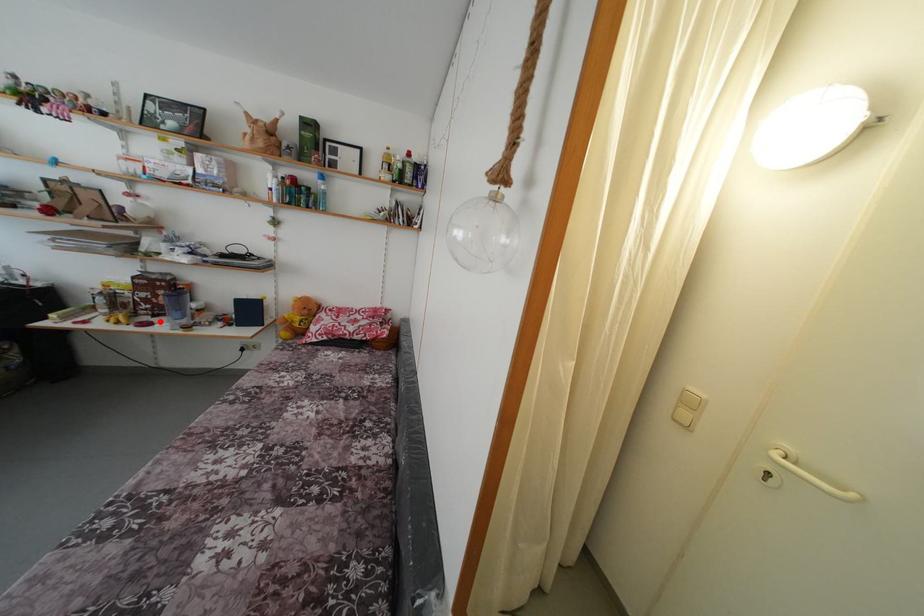
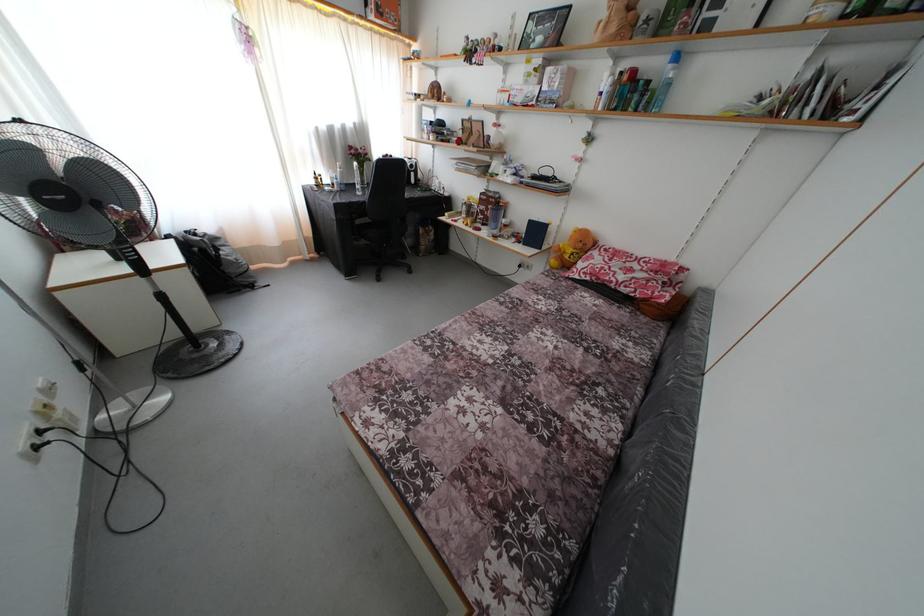
Question: I am providing you with two images of the same scene from different viewpoints. In image1, a red point is highlighted. Considering the same 3D point in image2, which of the following is correct?

Choices:
 (A) It is closer
 (B) It is farther

Answer: (A)